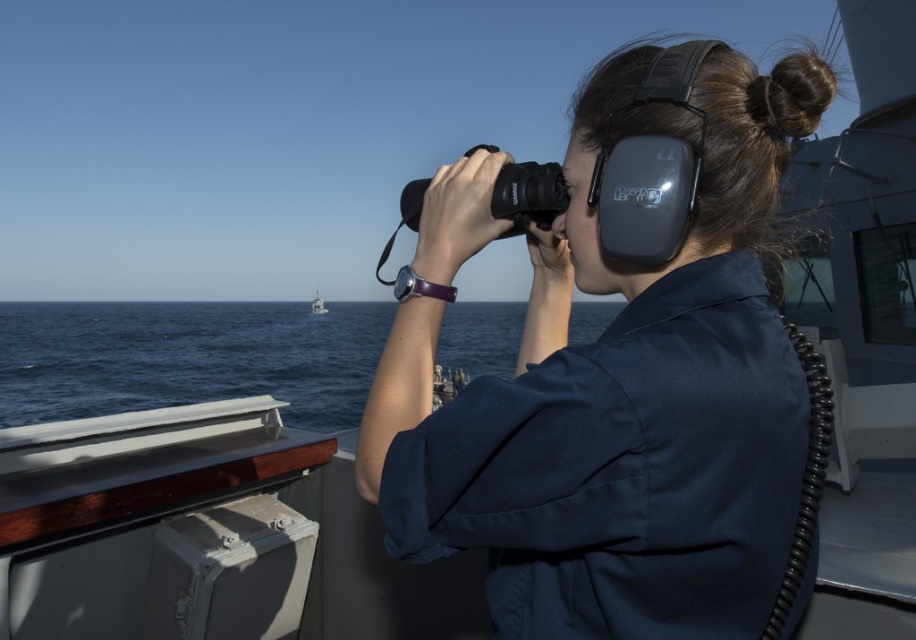
Which is more to the right, matte black binoculars at center or white plastic boat at center?

matte black binoculars at center is more to the right.

Looking at this image, who is higher up, matte black binoculars at center or white plastic boat at center?

Positioned higher is white plastic boat at center.

Where is `matte black binoculars at center`? matte black binoculars at center is located at coordinates (620, 372).

Is point (458, 502) positioned behind point (349, 312)?

No, (458, 502) is in front of (349, 312).

Who is positioned more to the left, matte black binoculars at center or blue water at lower left?

blue water at lower left

This screenshot has width=916, height=640. What do you see at coordinates (620, 372) in the screenshot?
I see `matte black binoculars at center` at bounding box center [620, 372].

I want to click on matte black binoculars at center, so click(x=620, y=372).

Can you confirm if blue water at lower left is shorter than white plastic boat at center?

No.

Consider the image. Is blue water at lower left further to camera compared to white plastic boat at center?

That is False.

You are a GUI agent. You are given a task and a screenshot of the screen. Output one action in this format:
    pyautogui.click(x=<x>, y=<y>)
    Task: Click on the blue water at lower left
    Image resolution: width=916 pixels, height=640 pixels.
    Given the screenshot: What is the action you would take?
    pyautogui.click(x=186, y=356)